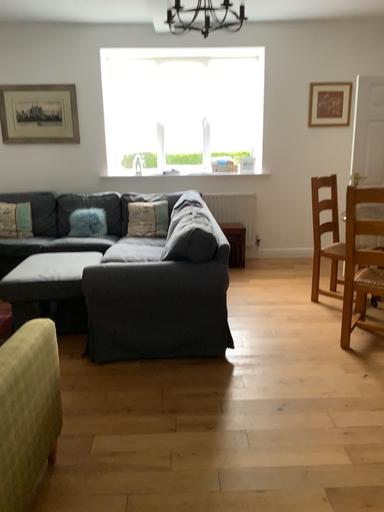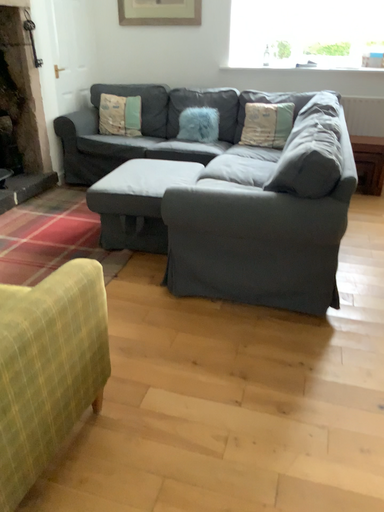
Question: How did the camera likely rotate when shooting the video?

Choices:
 (A) rotated right
 (B) rotated left

Answer: (B)